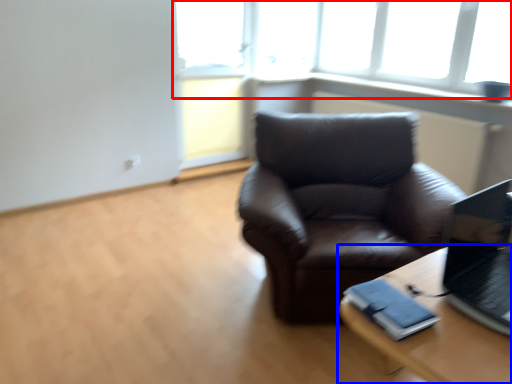
Question: Which of the following is the farthest to the observer, window (highlighted by a red box) or table (highlighted by a blue box)?

Choices:
 (A) window
 (B) table

Answer: (A)